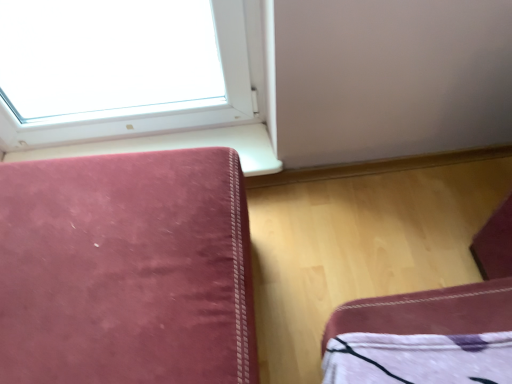
Question: Is velvet-like pink sofa at left next to velvet-like pink cushion at lower left and touching it?

Choices:
 (A) no
 (B) yes

Answer: (A)

Question: Is velvet-like pink sofa at left facing towards velvet-like pink cushion at lower left?

Choices:
 (A) yes
 (B) no

Answer: (B)

Question: Is velvet-like pink sofa at left positioned behind velvet-like pink cushion at lower left?

Choices:
 (A) no
 (B) yes

Answer: (A)

Question: Is velvet-like pink cushion at lower left at the back of velvet-like pink sofa at left?

Choices:
 (A) yes
 (B) no

Answer: (A)

Question: Is velvet-like pink sofa at left wider than velvet-like pink cushion at lower left?

Choices:
 (A) no
 (B) yes

Answer: (B)

Question: From the image's perspective, does velvet-like pink sofa at left appear lower than velvet-like pink cushion at lower left?

Choices:
 (A) yes
 (B) no

Answer: (A)

Question: Is velvet-like pink cushion at lower left at the left side of velvet-like pink sofa at left?

Choices:
 (A) no
 (B) yes

Answer: (A)

Question: Is the surface of velvet-like pink cushion at lower left in direct contact with velvet-like pink sofa at left?

Choices:
 (A) no
 (B) yes

Answer: (A)

Question: Is velvet-like pink cushion at lower left oriented towards velvet-like pink sofa at left?

Choices:
 (A) no
 (B) yes

Answer: (B)

Question: Is velvet-like pink cushion at lower left completely or partially outside of velvet-like pink sofa at left?

Choices:
 (A) yes
 (B) no

Answer: (A)

Question: Is velvet-like pink cushion at lower left not close to velvet-like pink sofa at left?

Choices:
 (A) no
 (B) yes

Answer: (A)

Question: Is velvet-like pink cushion at lower left turned away from velvet-like pink sofa at left?

Choices:
 (A) no
 (B) yes

Answer: (A)

Question: In the image, is velvet-like pink cushion at lower left on the left side or the right side of velvet-like pink sofa at left?

Choices:
 (A) right
 (B) left

Answer: (A)